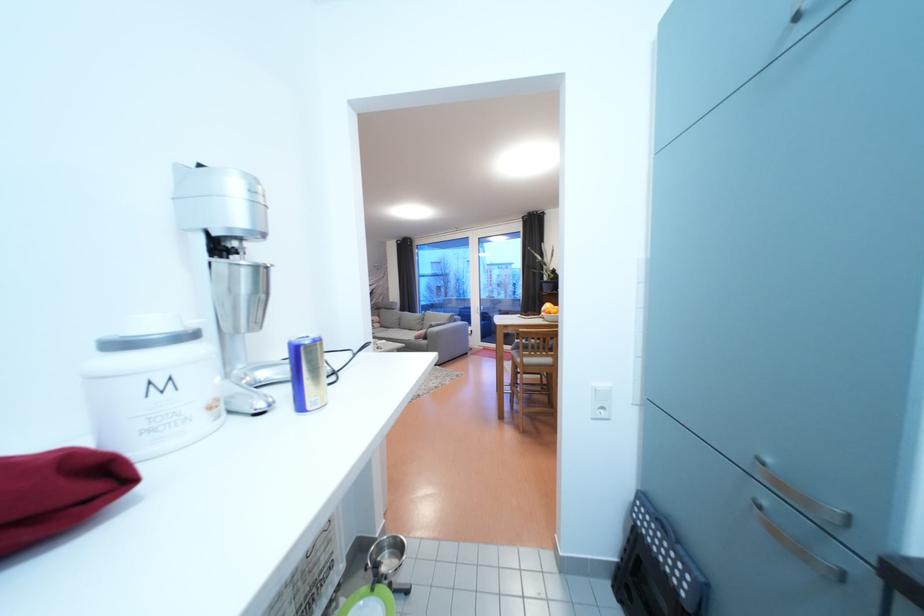
Describe the element at coordinates (535, 374) in the screenshot. The width and height of the screenshot is (924, 616). I see `the chair sitting surface` at that location.